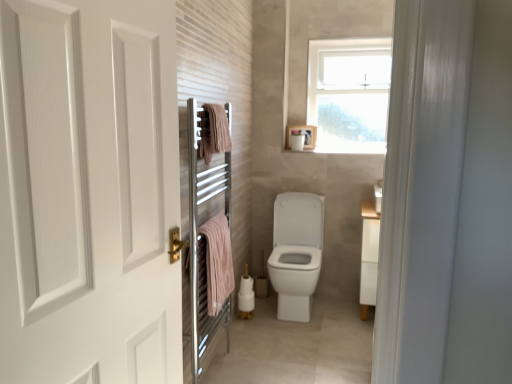
Question: Does chrome metallic towel warmer at left have a lesser height compared to pink cotton towel at left, acting as the 2th bath towel starting from the top?

Choices:
 (A) no
 (B) yes

Answer: (A)

Question: Can you confirm if chrome metallic towel warmer at left is wider than pink cotton towel at left, which is the first bath towel in bottom-to-top order?

Choices:
 (A) no
 (B) yes

Answer: (A)

Question: From a real-world perspective, is chrome metallic towel warmer at left on top of pink cotton towel at left, which is the first bath towel in bottom-to-top order?

Choices:
 (A) no
 (B) yes

Answer: (B)

Question: Is chrome metallic towel warmer at left aimed at pink cotton towel at left, acting as the 2th bath towel starting from the top?

Choices:
 (A) no
 (B) yes

Answer: (B)

Question: From the image's perspective, does chrome metallic towel warmer at left appear lower than pink cotton towel at left, acting as the 2th bath towel starting from the top?

Choices:
 (A) no
 (B) yes

Answer: (A)

Question: From a real-world perspective, is pink cotton towel at upper center, positioned as the 2th bath towel in bottom-to-top order, physically located above or below white matte door at left?

Choices:
 (A) below
 (B) above

Answer: (B)

Question: In the image, is pink cotton towel at upper center, positioned as the 2th bath towel in bottom-to-top order, on the left side or the right side of white matte door at left?

Choices:
 (A) right
 (B) left

Answer: (A)

Question: Considering the positions of pink cotton towel at upper center, positioned as the 2th bath towel in bottom-to-top order, and white matte door at left in the image, is pink cotton towel at upper center, positioned as the 2th bath towel in bottom-to-top order, taller or shorter than white matte door at left?

Choices:
 (A) tall
 (B) short

Answer: (B)

Question: From the image's perspective, is pink cotton towel at upper center, positioned as the 2th bath towel in bottom-to-top order, positioned above or below white matte door at left?

Choices:
 (A) below
 (B) above

Answer: (B)

Question: Considering the positions of white matte door at left and white matte toilet paper at upper center in the image, is white matte door at left taller or shorter than white matte toilet paper at upper center?

Choices:
 (A) short
 (B) tall

Answer: (B)

Question: Is point (159, 3) closer or farther from the camera than point (304, 137)?

Choices:
 (A) closer
 (B) farther

Answer: (A)

Question: In terms of width, does white matte door at left look wider or thinner when compared to white matte toilet paper at upper center?

Choices:
 (A) wide
 (B) thin

Answer: (A)

Question: From the image's perspective, is white matte door at left above or below white matte toilet paper at upper center?

Choices:
 (A) below
 (B) above

Answer: (A)

Question: From a real-world perspective, relative to pink cotton towel at left, which is the first bath towel in bottom-to-top order, is white matte toilet paper at upper center vertically above or below?

Choices:
 (A) below
 (B) above

Answer: (B)

Question: From the image's perspective, is white matte toilet paper at upper center located above or below pink cotton towel at left, which is the first bath towel in bottom-to-top order?

Choices:
 (A) below
 (B) above

Answer: (B)